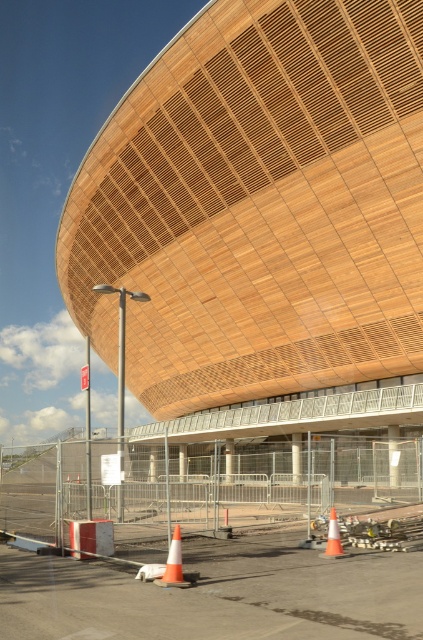
Who is lower down, smooth asphalt tarmac at lower center or orange reflective cone at lower center?

orange reflective cone at lower center is lower down.

Locate an element on the screen. This screenshot has width=423, height=640. smooth asphalt tarmac at lower center is located at coordinates (216, 595).

Can you confirm if orange/reflective traffic cone at lower center is thinner than orange reflective cone at lower center?

No.

Is orange/reflective traffic cone at lower center bigger than orange reflective cone at lower center?

Yes.

You are a GUI agent. You are given a task and a screenshot of the screen. Output one action in this format:
    pyautogui.click(x=<x>, y=<y>)
    Task: Click on the orange/reflective traffic cone at lower center
    This screenshot has width=423, height=640.
    Given the screenshot: What is the action you would take?
    pyautogui.click(x=173, y=563)

Based on the photo, is smooth asphalt tarmac at lower center thinner than orange/reflective traffic cone at lower center?

Incorrect, smooth asphalt tarmac at lower center's width is not less than orange/reflective traffic cone at lower center's.

Which is above, smooth asphalt tarmac at lower center or orange/reflective traffic cone at lower center?

orange/reflective traffic cone at lower center is higher up.

What do you see at coordinates (216, 595) in the screenshot? This screenshot has height=640, width=423. I see `smooth asphalt tarmac at lower center` at bounding box center [216, 595].

Where is `smooth asphalt tarmac at lower center`? This screenshot has width=423, height=640. smooth asphalt tarmac at lower center is located at coordinates (216, 595).